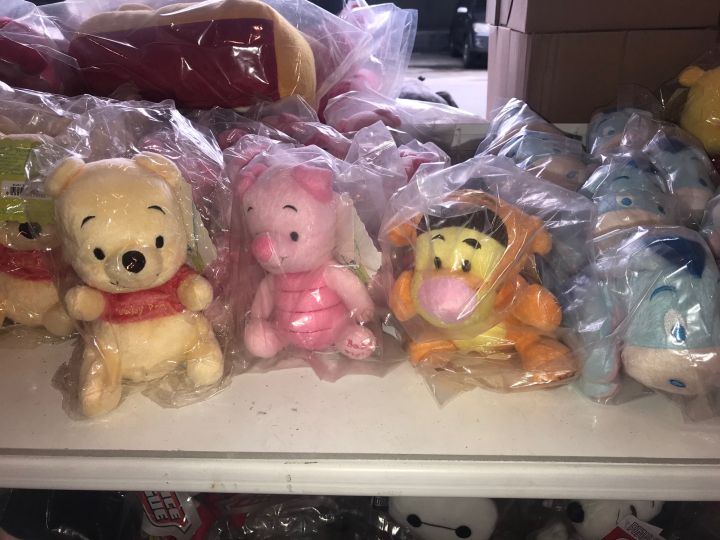
You are a GUI agent. You are given a task and a screenshot of the screen. Output one action in this format:
    pyautogui.click(x=<x>, y=<y>)
    Task: Click on the piglet plush toys
    The height and width of the screenshot is (540, 720).
    Given the screenshot: What is the action you would take?
    pyautogui.click(x=302, y=246), pyautogui.click(x=361, y=121), pyautogui.click(x=361, y=82), pyautogui.click(x=330, y=137), pyautogui.click(x=243, y=145), pyautogui.click(x=274, y=114), pyautogui.click(x=225, y=133)